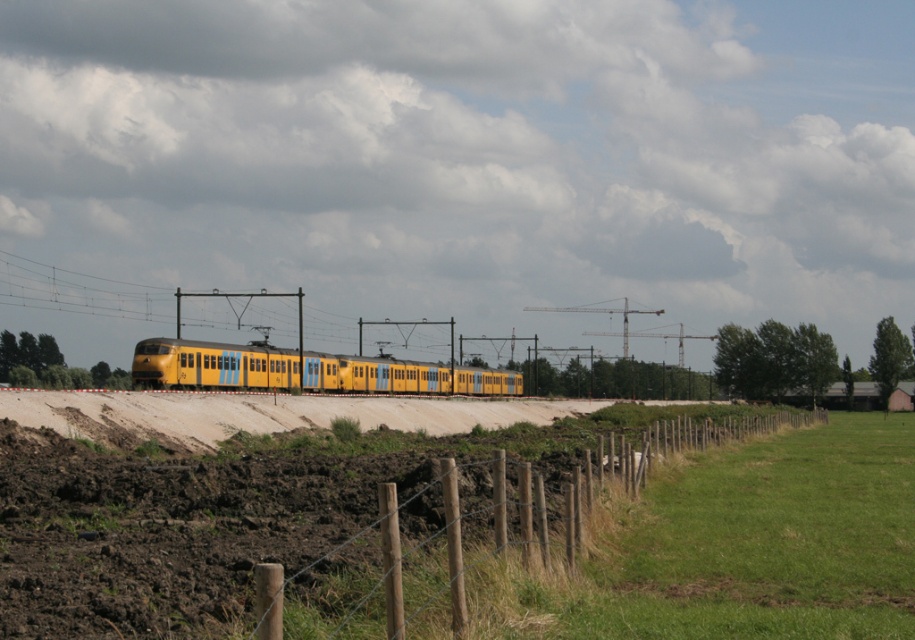
Is yellow matte train at center below wooden post wire fence at lower right?

Incorrect, yellow matte train at center is not positioned below wooden post wire fence at lower right.

Does yellow matte train at center have a larger size compared to wooden post wire fence at lower right?

No, yellow matte train at center is not bigger than wooden post wire fence at lower right.

Does point (291, 378) come in front of point (394, 522)?

No, it is not.

The height and width of the screenshot is (640, 915). I want to click on yellow matte train at center, so click(304, 371).

Is the position of green grass at lower right less distant than that of yellow matte train at center?

Yes, green grass at lower right is closer to the viewer.

Can you confirm if green grass at lower right is thinner than yellow matte train at center?

Yes.

Who is more distant from viewer, (910, 589) or (197, 355)?

The point (197, 355) is behind.

Locate an element on the screen. The width and height of the screenshot is (915, 640). green grass at lower right is located at coordinates (768, 541).

Which of these two, green grass at lower right or wooden post wire fence at lower right, stands taller?

With more height is wooden post wire fence at lower right.

Which is below, green grass at lower right or wooden post wire fence at lower right?

wooden post wire fence at lower right

Find the location of `green grass at lower right`. green grass at lower right is located at coordinates (768, 541).